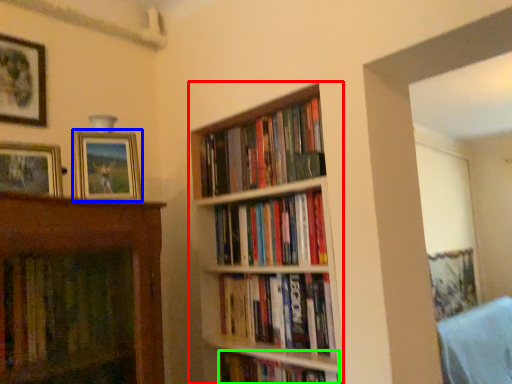
Question: Based on their relative distances, which object is farther from shelf (highlighted by a red box)? Choose from picture frame (highlighted by a blue box) and book (highlighted by a green box).

Choices:
 (A) picture frame
 (B) book

Answer: (A)